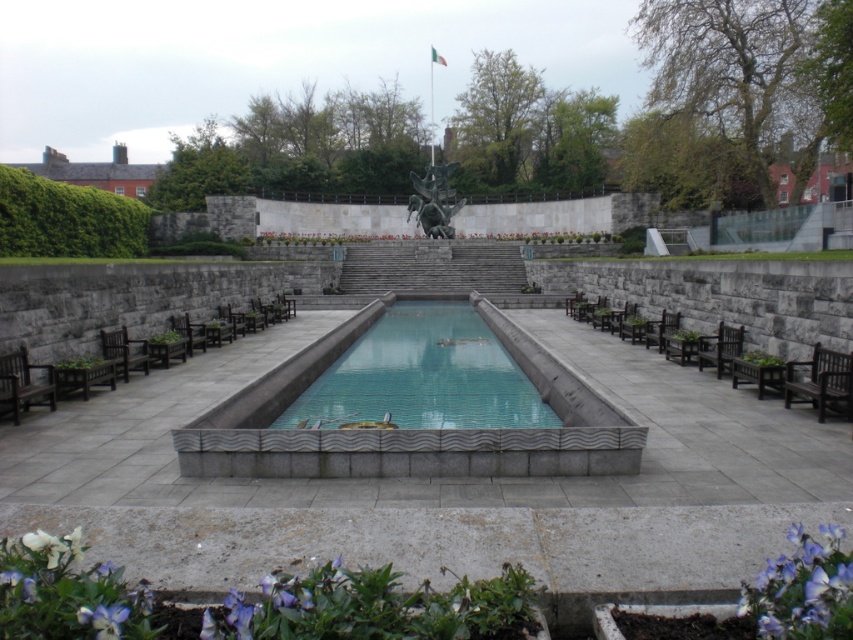
Question: Does smooth concrete pool at center appear over dark brown wooden bench at lower left?

Choices:
 (A) yes
 (B) no

Answer: (A)

Question: Is the position of brown wooden bench at right less distant than that of brown wooden chair at lower left?

Choices:
 (A) yes
 (B) no

Answer: (A)

Question: Which point is farther to the camera?

Choices:
 (A) wooden bench at left
 (B) purple matte flower at lower left

Answer: (A)

Question: Among these objects, which one is nearest to the camera?

Choices:
 (A) bronze statue at center
 (B) blue tile swimming pool at center
 (C) purple matte flower at lower right
 (D) dark brown wooden chair at right

Answer: (C)

Question: Does purple matte flower at lower right appear on the right side of dark brown wooden bench at lower left?

Choices:
 (A) yes
 (B) no

Answer: (A)

Question: Which point is farther to the camera?

Choices:
 (A) (715, 340)
 (B) (120, 618)
 (C) (416, 433)
 (D) (500, 396)

Answer: (A)